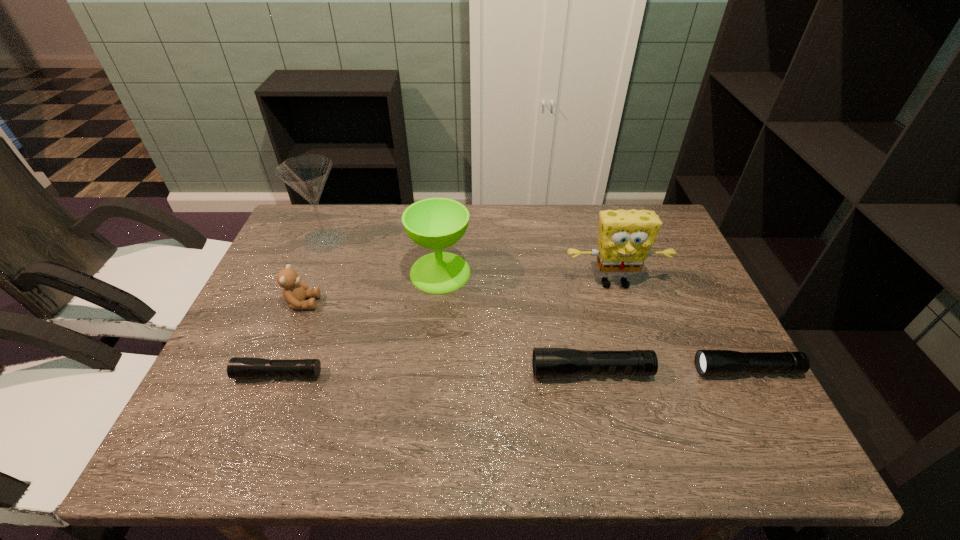
Image resolution: width=960 pixels, height=540 pixels. What are the coordinates of `free region located 0.130m at the lens end of the second flashlight from left to right` in the screenshot? It's located at (475, 372).

The height and width of the screenshot is (540, 960). I want to click on free point located 0.300m at the lens end of the second flashlight from left to right, so click(400, 372).

Locate an element on the screen. This screenshot has height=540, width=960. free location located at the lens end of the second tallest flashlight is located at coordinates (577, 370).

Find the location of a particular element. This screenshot has height=540, width=960. free space located at the lens end of the second tallest flashlight is located at coordinates (551, 370).

The width and height of the screenshot is (960, 540). I want to click on vacant space located 0.200m at the lens end of the second tallest flashlight, so click(x=608, y=370).

This screenshot has height=540, width=960. In order to click on free space located 0.190m on the front of the fourth object from right to left in this screenshot , I will do `click(432, 351)`.

Where is `vacant area situated on the back of the flute glass`? This screenshot has height=540, width=960. vacant area situated on the back of the flute glass is located at coordinates (337, 213).

This screenshot has width=960, height=540. I want to click on vacant space situated on the face of the fourth tallest object, so click(x=438, y=303).

Locate an element on the screen. free spot located on the face of the sponge is located at coordinates (624, 313).

Image resolution: width=960 pixels, height=540 pixels. What are the coordinates of `object that is at the far edge` in the screenshot? It's located at (307, 174).